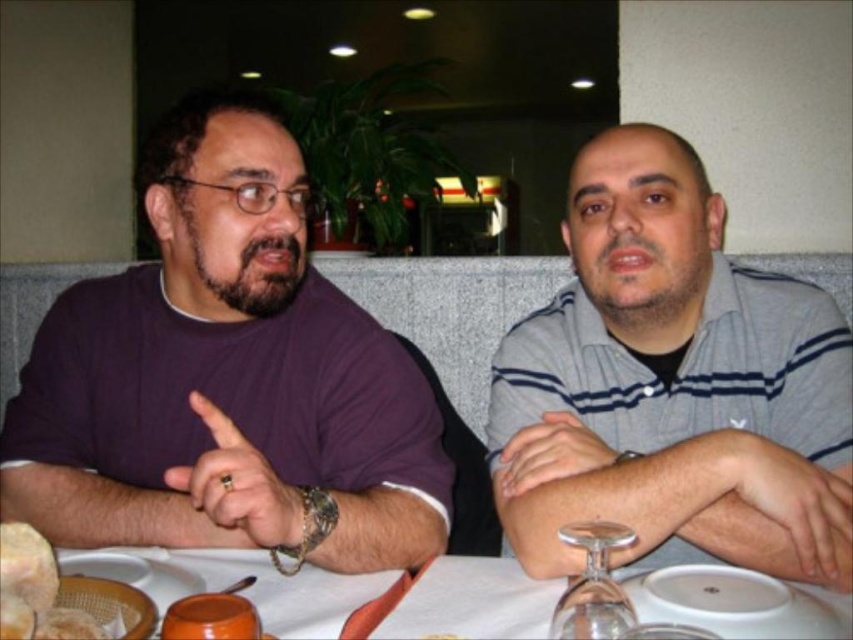
Consider the image. You are standing at the entrance of the dining area and see the purple matte shirt at left and the white glossy table at lower center. Which object is positioned more to the left side of the scene?

The purple matte shirt at left is positioned more to the left side of the scene than the white glossy table at lower center.

You are a waiter who needs to place a 10 inch long menu on the table between the purple matte shirt at left and the white glossy table at lower center. Will the menu fit between them?

The purple matte shirt at left is 8.31 inches away from the white glossy table at lower center. Since the menu is 10 inches long, it will not fit between them as the distance is shorter than the menu length.

You are a server at a restaurant and need to place a new dessert plate on the table. Given the current items on the table, can you fit the dessert plate on the white glossy table at lower center without overlapping the transparent glass wine glass at lower center?

The white glossy table at lower center is larger in size than transparent glass wine glass at lower center, so yes, the dessert plate can be placed on the white glossy table at lower center without overlapping the transparent glass wine glass at lower center.